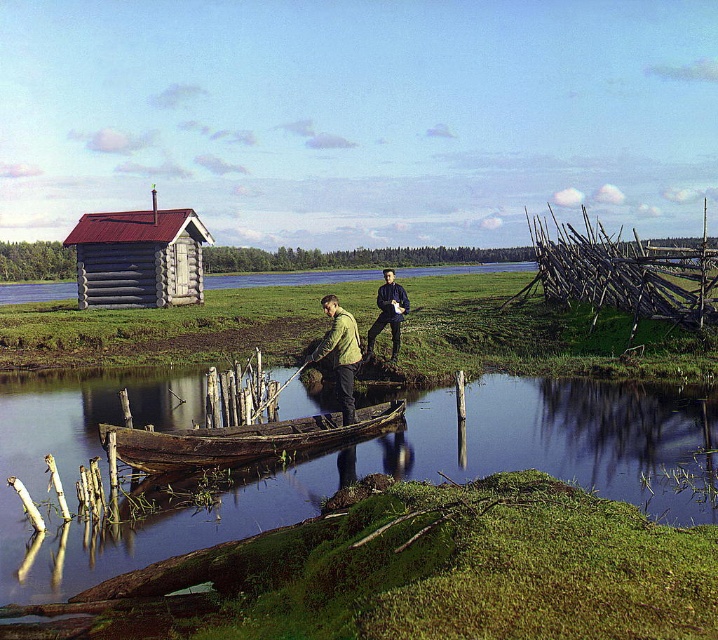
Question: Is gray wooden log cabin at left above dark blue jeans at center?

Choices:
 (A) no
 (B) yes

Answer: (B)

Question: Among these points, which one is farthest from the camera?

Choices:
 (A) (401, 300)
 (B) (704, 458)

Answer: (A)

Question: Which point is closer to the camera?

Choices:
 (A) dark blue jeans at center
 (B) clear water at boat center
 (C) green matte jacket at center

Answer: (B)

Question: Observing the image, what is the correct spatial positioning of gray wooden log cabin at left in reference to dark blue jeans at center?

Choices:
 (A) right
 (B) left

Answer: (B)

Question: Which of the following is the closest to the observer?

Choices:
 (A) green matte jacket at center
 (B) wooden canoe at center

Answer: (B)

Question: In this image, where is clear water at boat center located relative to gray wooden log cabin at left?

Choices:
 (A) left
 (B) right

Answer: (B)